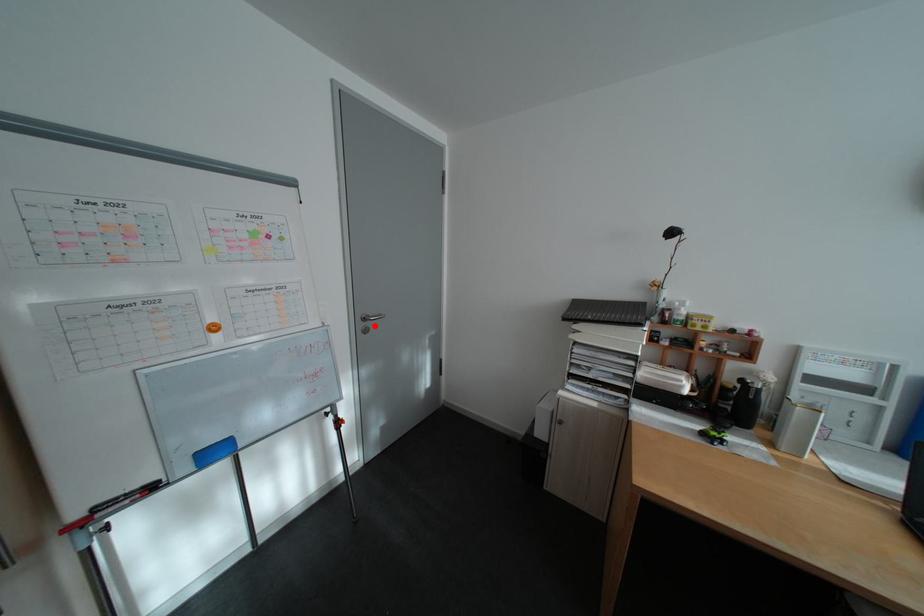
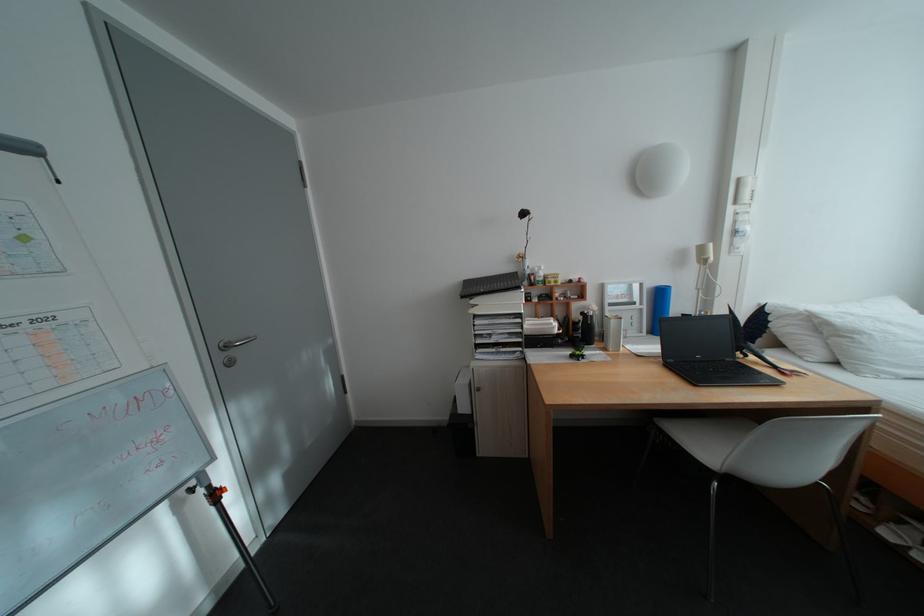
The point at the highlighted location is marked in the first image. Where is the corresponding point in the second image?

(234, 358)